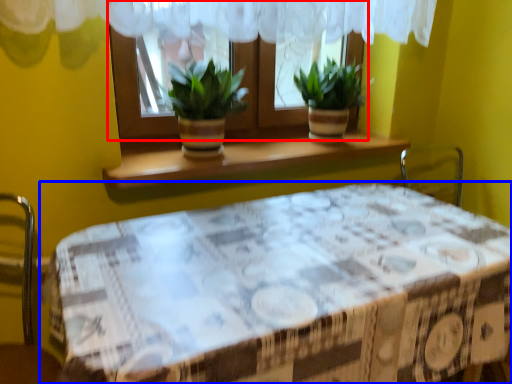
Question: Among these objects, which one is farthest to the camera, window (highlighted by a red box) or table (highlighted by a blue box)?

Choices:
 (A) window
 (B) table

Answer: (A)